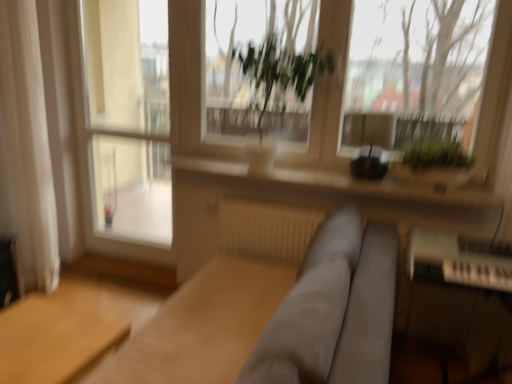
Question: Is light brown wooden table at lower left not near green leafy plant at center, marked as the first vegetation in a left-to-right arrangement?

Choices:
 (A) yes
 (B) no

Answer: (A)

Question: Could you tell me if light brown wooden table at lower left is turned towards green leafy plant at center, the second vegetation viewed from the right?

Choices:
 (A) no
 (B) yes

Answer: (A)

Question: Is green leafy plant at center, marked as the first vegetation in a left-to-right arrangement, a part of light brown wooden table at lower left?

Choices:
 (A) no
 (B) yes

Answer: (A)

Question: Is light brown wooden table at lower left taller than green leafy plant at center, marked as the first vegetation in a left-to-right arrangement?

Choices:
 (A) no
 (B) yes

Answer: (A)

Question: Is light brown wooden table at lower left at the left side of green leafy plant at center, the second vegetation viewed from the right?

Choices:
 (A) no
 (B) yes

Answer: (B)

Question: Is point (434, 309) positioned closer to the camera than point (133, 124)?

Choices:
 (A) farther
 (B) closer

Answer: (B)

Question: From a real-world perspective, is white plastic piano at lower right positioned above or below white glass screen door at left?

Choices:
 (A) below
 (B) above

Answer: (A)

Question: In terms of size, does white plastic piano at lower right appear bigger or smaller than white glass screen door at left?

Choices:
 (A) small
 (B) big

Answer: (B)

Question: In terms of width, does white plastic piano at lower right look wider or thinner when compared to white glass screen door at left?

Choices:
 (A) wide
 (B) thin

Answer: (A)

Question: Choose the correct answer: Is light brown wooden table at lower left inside gray fabric couch at center or outside it?

Choices:
 (A) outside
 (B) inside

Answer: (A)

Question: From a real-world perspective, is light brown wooden table at lower left physically located above or below gray fabric couch at center?

Choices:
 (A) below
 (B) above

Answer: (A)

Question: Is light brown wooden table at lower left to the left or to the right of gray fabric couch at center in the image?

Choices:
 (A) right
 (B) left

Answer: (B)

Question: From the image's perspective, is light brown wooden table at lower left positioned above or below gray fabric couch at center?

Choices:
 (A) above
 (B) below

Answer: (B)

Question: From a real-world perspective, is green leafy plant at center, the second vegetation viewed from the right, physically located above or below white glass screen door at left?

Choices:
 (A) below
 (B) above

Answer: (B)

Question: From the image's perspective, is green leafy plant at center, marked as the first vegetation in a left-to-right arrangement, located above or below white glass screen door at left?

Choices:
 (A) above
 (B) below

Answer: (A)